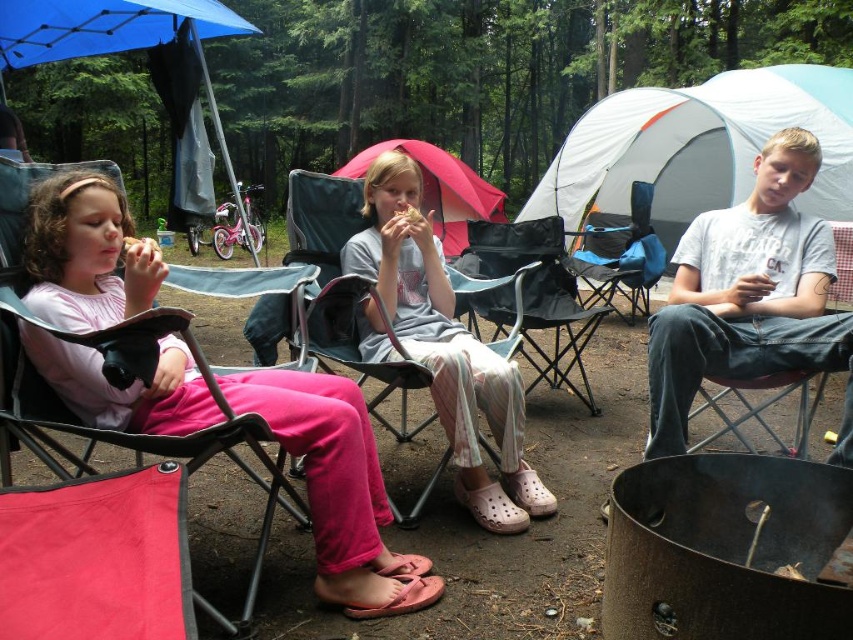
You are a parent at the campsite and need to seat two more children. You have a small stool that can only fit under chairs with at least 40 cm of space. Which chair between the matte black folding chair at left and the pink fabric chair at center would allow the stool to fit underneath?

The matte black folding chair at left has a larger size compared to the pink fabric chair at center, so it likely has more space underneath to accommodate the stool.